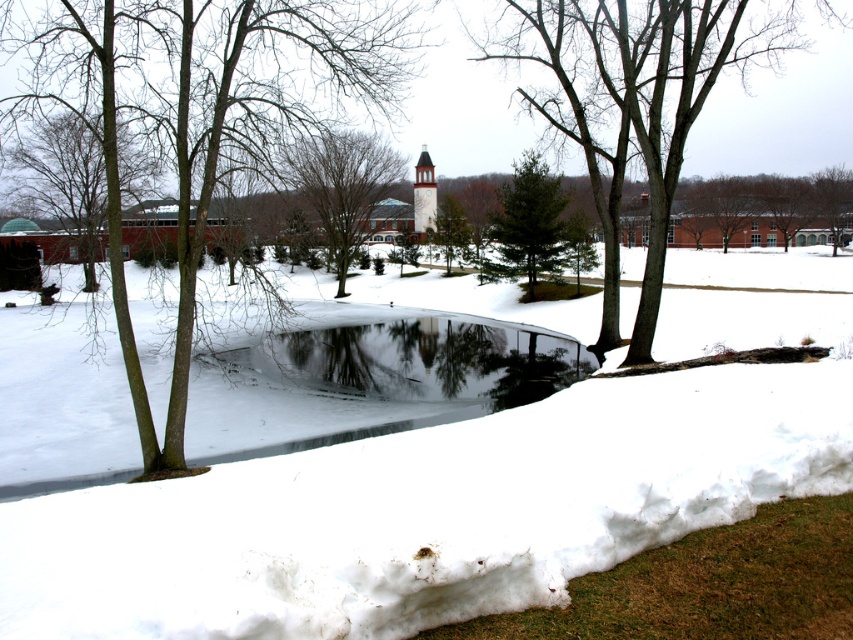
Between brown bark tree at left and brown textured tree at left, which one appears on the right side from the viewer's perspective?

brown bark tree at left

You are a GUI agent. You are given a task and a screenshot of the screen. Output one action in this format:
    pyautogui.click(x=<x>, y=<y>)
    Task: Click on the brown bark tree at left
    Image resolution: width=853 pixels, height=640 pixels.
    Given the screenshot: What is the action you would take?
    pyautogui.click(x=206, y=115)

Is point (520, 26) positioned behind point (834, 228)?

No, it is in front of (834, 228).

Measure the distance from green leafy tree at center to brown textured tree at upper right.

A distance of 35.59 meters exists between green leafy tree at center and brown textured tree at upper right.

Between point (671, 17) and point (828, 180), which one is positioned in front?

Point (671, 17)

The image size is (853, 640). Identify the location of green leafy tree at center. (634, 99).

Between point (567, 76) and point (73, 208), which one is positioned behind?

Positioned behind is point (73, 208).

Which is below, green leafy tree at center or brown textured tree at left?

Positioned lower is brown textured tree at left.

Who is more forward, (532, 32) or (68, 204)?

Point (532, 32) is in front.

Locate an element on the screen. The width and height of the screenshot is (853, 640). green leafy tree at center is located at coordinates (634, 99).